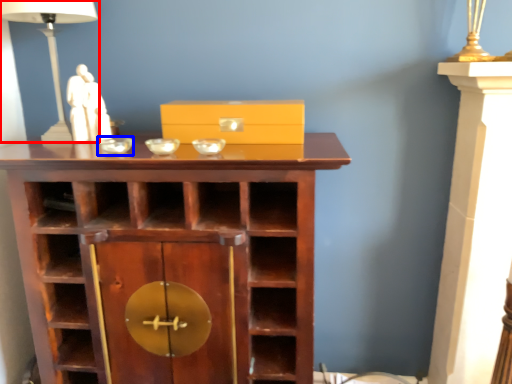
Question: Which point is further to the camera, table lamp (highlighted by a red box) or glass bowl (highlighted by a blue box)?

Choices:
 (A) table lamp
 (B) glass bowl

Answer: (A)